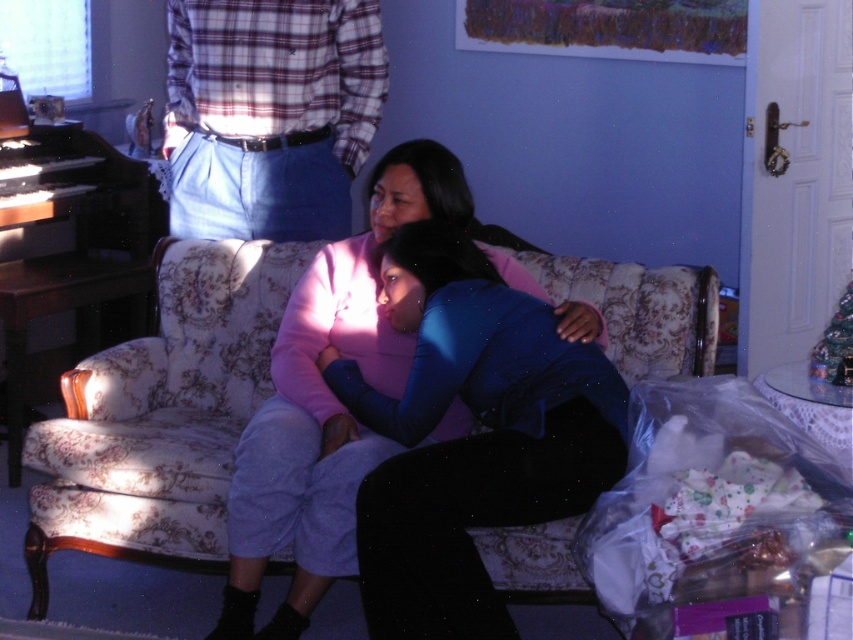
Question: Which point is closer to the camera?

Choices:
 (A) (511, 252)
 (B) (492, 326)

Answer: (B)

Question: Which is farther from the floral fabric couch at center?

Choices:
 (A) blue matte shirt at center
 (B) plaid fabric shirt at upper center

Answer: (A)

Question: Which point is closer to the camera?

Choices:
 (A) (567, 477)
 (B) (97, 522)

Answer: (A)

Question: Can you confirm if blue matte shirt at center is positioned to the left of plaid fabric shirt at upper center?

Choices:
 (A) yes
 (B) no

Answer: (B)

Question: Does floral fabric couch at center come in front of plaid fabric shirt at upper center?

Choices:
 (A) yes
 (B) no

Answer: (A)

Question: Does floral fabric couch at center have a smaller size compared to blue matte shirt at center?

Choices:
 (A) yes
 (B) no

Answer: (B)